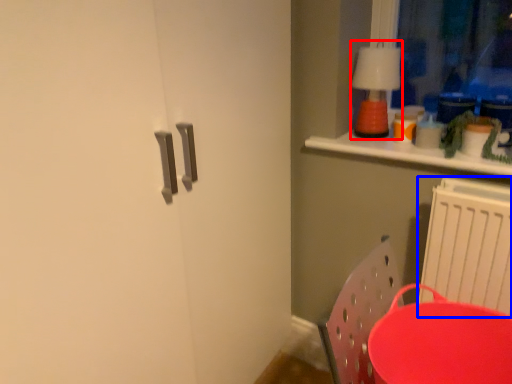
Question: Among these objects, which one is nearest to the camera, lamp (highlighted by a red box) or radiator (highlighted by a blue box)?

Choices:
 (A) lamp
 (B) radiator

Answer: (B)